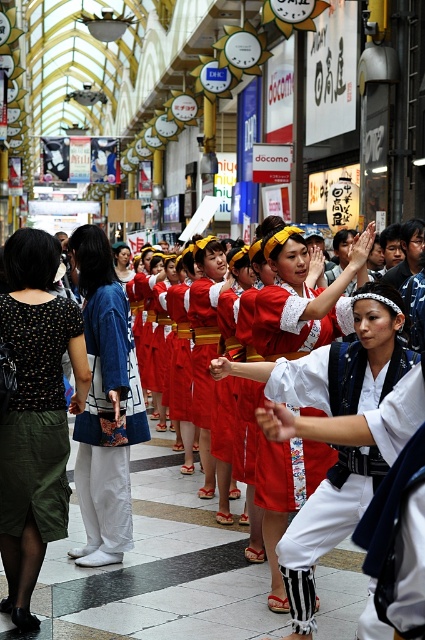
Question: Which is farther from the white cotton kimono at center?

Choices:
 (A) blue cotton kimono at left
 (B) polka dot blouse at center

Answer: (A)

Question: Is polka dot blouse at center to the left of white cotton kimono at center from the viewer's perspective?

Choices:
 (A) yes
 (B) no

Answer: (A)

Question: Does polka dot blouse at center lie behind blue cotton kimono at left?

Choices:
 (A) no
 (B) yes

Answer: (A)

Question: Among these objects, which one is nearest to the camera?

Choices:
 (A) polka dot blouse at center
 (B) white cotton kimono at center
 (C) blue cotton kimono at left

Answer: (B)

Question: Does polka dot blouse at center have a smaller size compared to white cotton kimono at center?

Choices:
 (A) yes
 (B) no

Answer: (B)

Question: Which of the following is the closest to the observer?

Choices:
 (A) blue cotton kimono at left
 (B) white cotton kimono at center
 (C) polka dot blouse at center

Answer: (B)